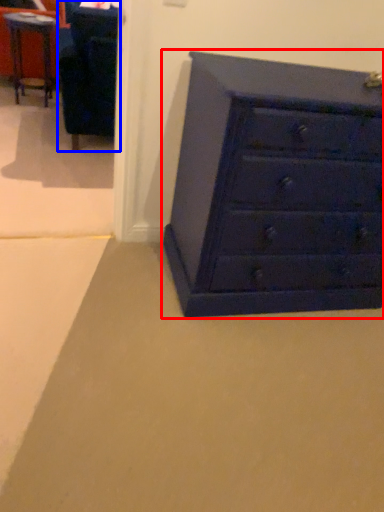
Question: Which point is closer to the camera, chest of drawers (highlighted by a red box) or furniture (highlighted by a blue box)?

Choices:
 (A) chest of drawers
 (B) furniture

Answer: (A)